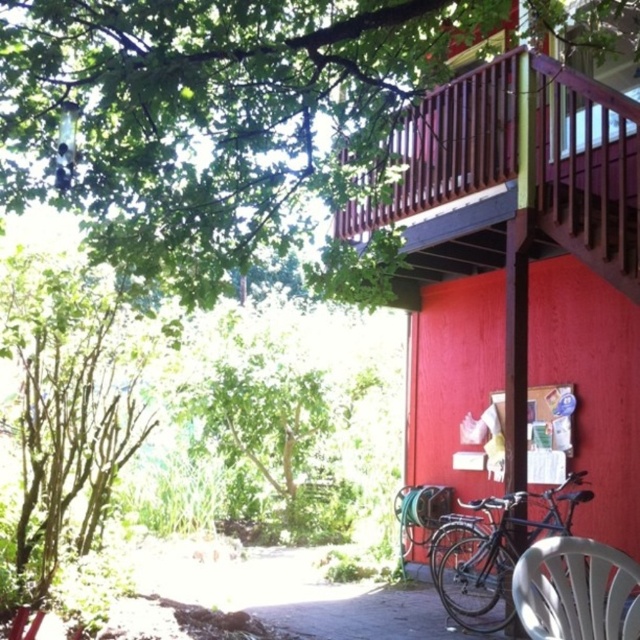
You are a painter standing at the red matte wood shed at center and need to reach the wooden at upper right to touch it. Can you reach it without moving your feet? The average arm length of a person is 28 inches.

The distance between the red matte wood shed at center and the wooden at upper right is 6.00 inches, which is less than the average arm length of 28 inches. Therefore, you can reach the wooden at upper right without moving your feet.

You are standing in the garden area and want to walk from the green leafy tree at left to the red matte wood shed at center. Which direction should you move to get closer to the shed?

You should move forward because the red matte wood shed at center is closer to you than the green leafy tree at left, so moving forward towards the shed will bring you closer.

You are standing in front of the red matte wood shed at center and want to find the green leafy tree at upper left. Which direction should you look to see it?

The green leafy tree at upper left is to the left of the red matte wood shed at center, so you should look to your left to see it.